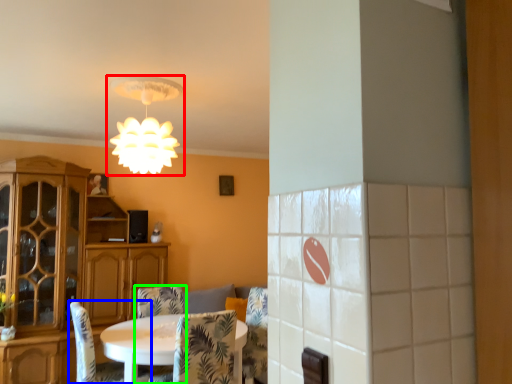
Question: Which object is the closest to the lamp (highlighted by a red box)? Choose among these: chair (highlighted by a blue box) or chair (highlighted by a green box).

Choices:
 (A) chair
 (B) chair

Answer: (A)